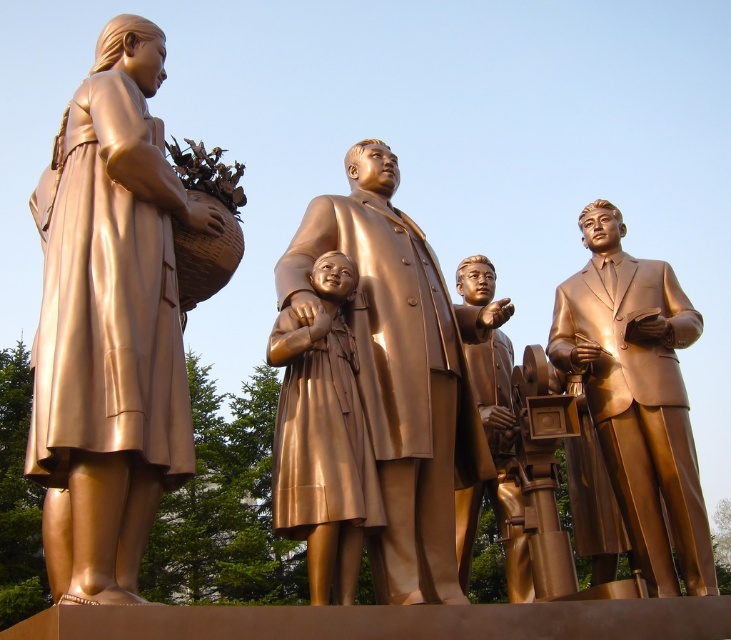
Is shiny bronze statue at right shorter than shiny bronze statue at center?

Incorrect, shiny bronze statue at right's height does not fall short of shiny bronze statue at center's.

Can you confirm if shiny bronze statue at right is taller than shiny bronze statue at center?

Correct, shiny bronze statue at right is much taller as shiny bronze statue at center.

Who is more distant from viewer, (681, 509) or (507, 353)?

Point (507, 353)

Locate an element on the screen. Image resolution: width=731 pixels, height=640 pixels. shiny bronze statue at right is located at coordinates tap(637, 397).

Between bronze statue of child at center and shiny bronze statue at center, which one is positioned higher?

bronze statue of child at center

Does bronze statue of child at center have a greater width compared to shiny bronze statue at center?

No.

What do you see at coordinates (322, 436) in the screenshot? The height and width of the screenshot is (640, 731). I see `bronze statue of child at center` at bounding box center [322, 436].

You are a GUI agent. You are given a task and a screenshot of the screen. Output one action in this format:
    pyautogui.click(x=<x>, y=<y>)
    Task: Click on the bronze statue of child at center
    The height and width of the screenshot is (640, 731).
    Given the screenshot: What is the action you would take?
    click(322, 436)

Who is taller, shiny bronze statue at right or bronze statue of child at center?

Standing taller between the two is shiny bronze statue at right.

Which is in front, point (643, 468) or point (292, 404)?

Point (292, 404) is in front.

At what (x,y) coordinates should I click in order to perform the action: click on shiny bronze statue at right. Please return your answer as a coordinate pair (x, y). This screenshot has width=731, height=640. Looking at the image, I should click on coord(637,397).